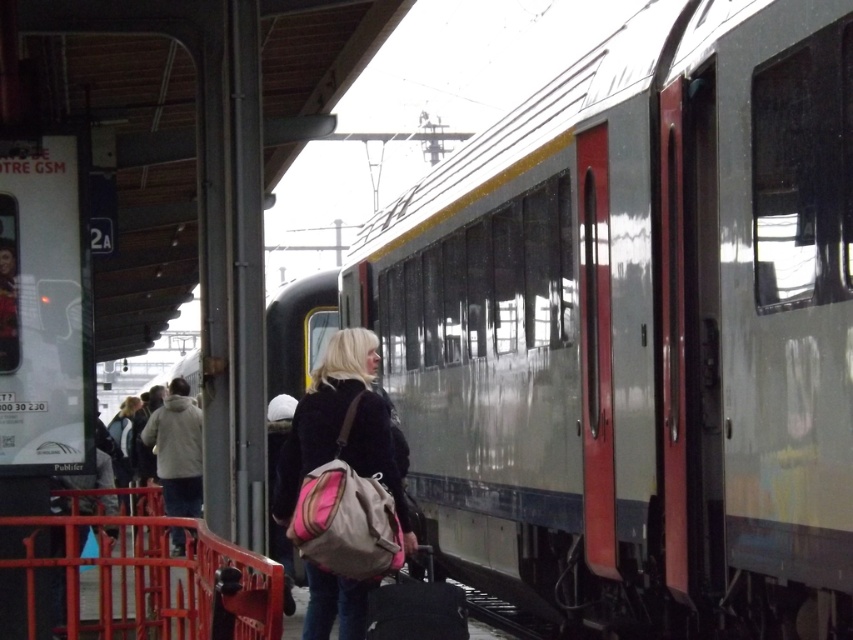
Consider the image. How far apart are metallic silver train at center and light gray fleece jacket at left?

metallic silver train at center is 10.01 meters away from light gray fleece jacket at left.

The height and width of the screenshot is (640, 853). In order to click on metallic silver train at center in this screenshot , I will do `click(640, 326)`.

The width and height of the screenshot is (853, 640). I want to click on metallic silver train at center, so click(x=640, y=326).

Between metallic silver train at center and matte black coat at center, which one appears on the left side from the viewer's perspective?

Positioned to the left is matte black coat at center.

In order to click on metallic silver train at center in this screenshot , I will do `click(640, 326)`.

Who is higher up, matte black coat at center or light gray fleece jacket at left?

matte black coat at center is higher up.

Can you confirm if matte black coat at center is positioned to the left of light gray fleece jacket at left?

No, matte black coat at center is not to the left of light gray fleece jacket at left.

Which is in front, point (358, 374) or point (177, 506)?

Point (358, 374) is in front.

Where is `matte black coat at center`? This screenshot has height=640, width=853. matte black coat at center is located at coordinates (323, 408).